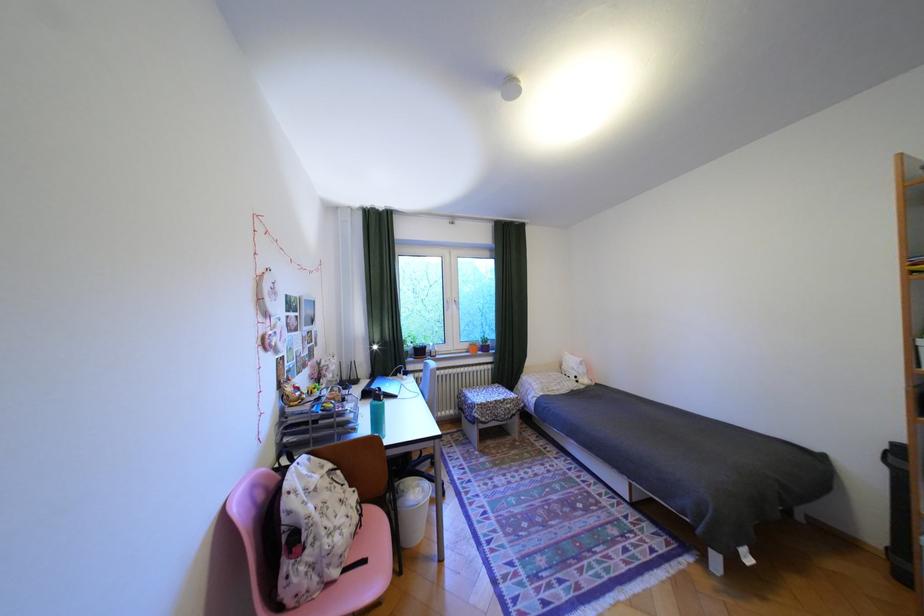
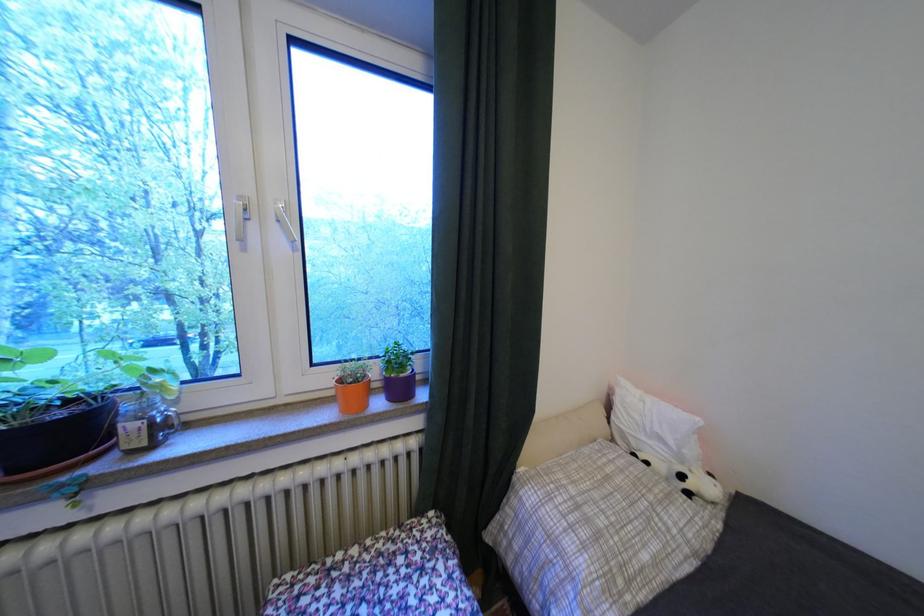
The point at (569,390) is marked in the first image. Where is the corresponding point in the second image?

(667, 562)